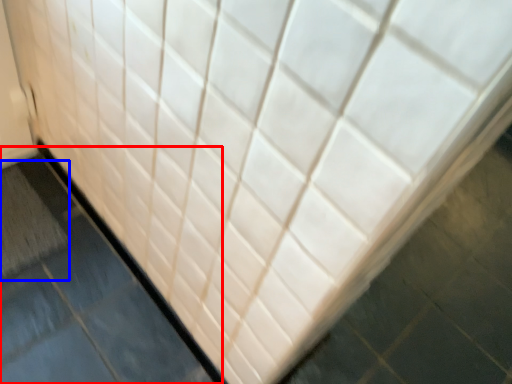
Question: Which of the following is the farthest to the observer, slate (highlighted by a red box) or bath mat (highlighted by a blue box)?

Choices:
 (A) slate
 (B) bath mat

Answer: (B)